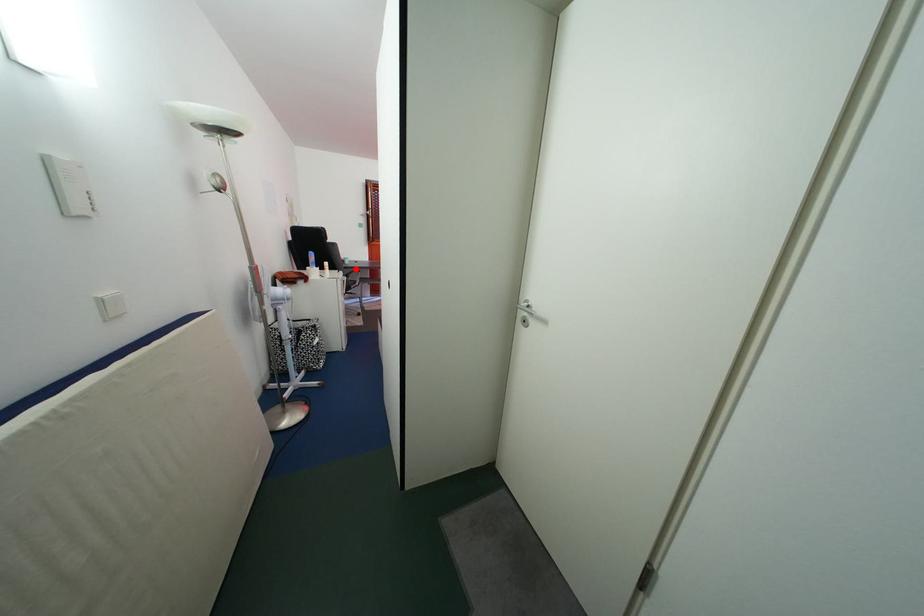
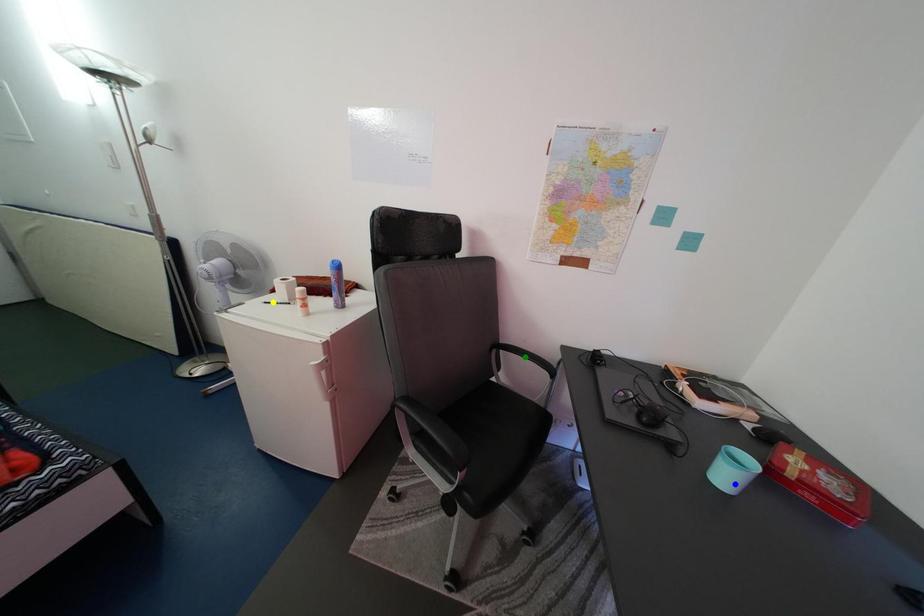
Question: I am providing you with two images of the same scene from different viewpoints. A red point is marked on the first image. You are given multiple points on the second image. Which point in image 2 represents the same 3d spot as the red point in image 1?

Choices:
 (A) green point
 (B) yellow point
 (C) blue point

Answer: (C)